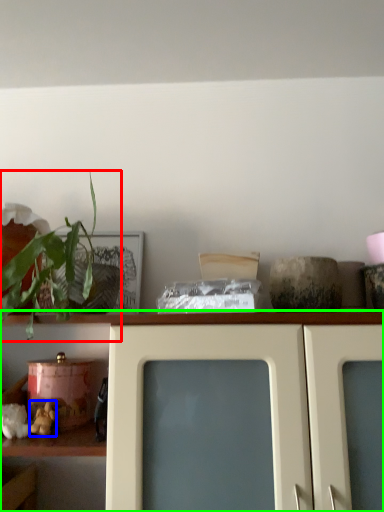
Question: Which is farther away from houseplant (highlighted by a red box)? stuff (highlighted by a blue box) or shelf (highlighted by a green box)?

Choices:
 (A) stuff
 (B) shelf

Answer: (A)